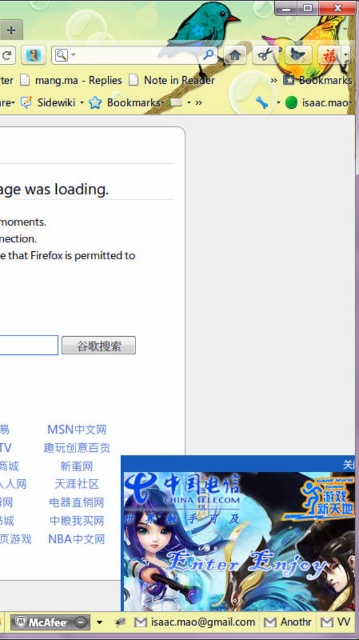
Question: Is matte plastic bird at upper right to the right of white glossy email address at bottom from the viewer's perspective?

Choices:
 (A) no
 (B) yes

Answer: (B)

Question: Can you confirm if matte plastic bird at upper right is bigger than white glossy email address at bottom?

Choices:
 (A) no
 (B) yes

Answer: (B)

Question: Among these points, which one is nearest to the camera?

Choices:
 (A) (170, 51)
 (B) (300, 61)

Answer: (B)

Question: Among these objects, which one is nearest to the camera?

Choices:
 (A) white glossy email address at bottom
 (B) metallic blue bird at upper center

Answer: (B)

Question: From the image, what is the correct spatial relationship of matte plastic bird at upper right in relation to metallic blue bird at upper center?

Choices:
 (A) above
 (B) below

Answer: (B)

Question: Which point appears closest to the camera in this image?

Choices:
 (A) (305, 74)
 (B) (244, 621)
 (C) (203, 6)

Answer: (C)